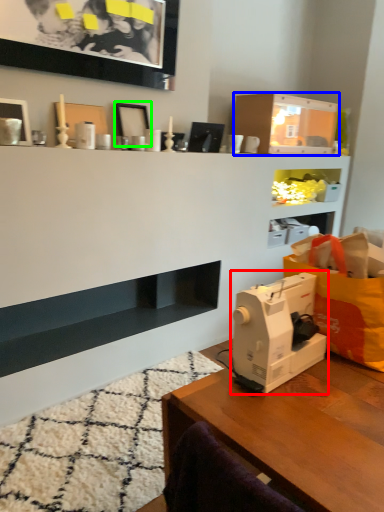
Question: Which object is positioned closest to sewing machine (highlighted by a red box)? Select from shelf (highlighted by a blue box) and picture frame (highlighted by a green box).

Choices:
 (A) shelf
 (B) picture frame

Answer: (B)